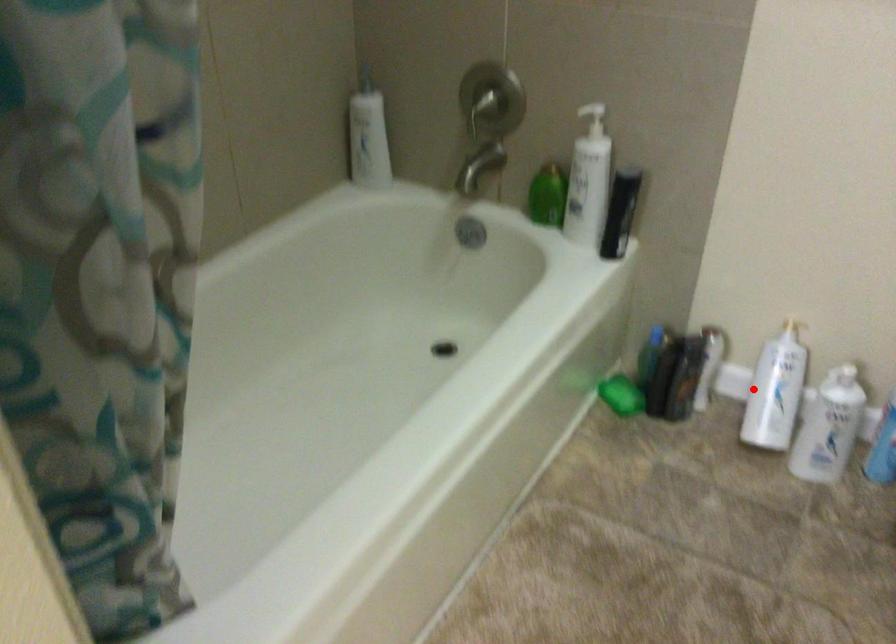
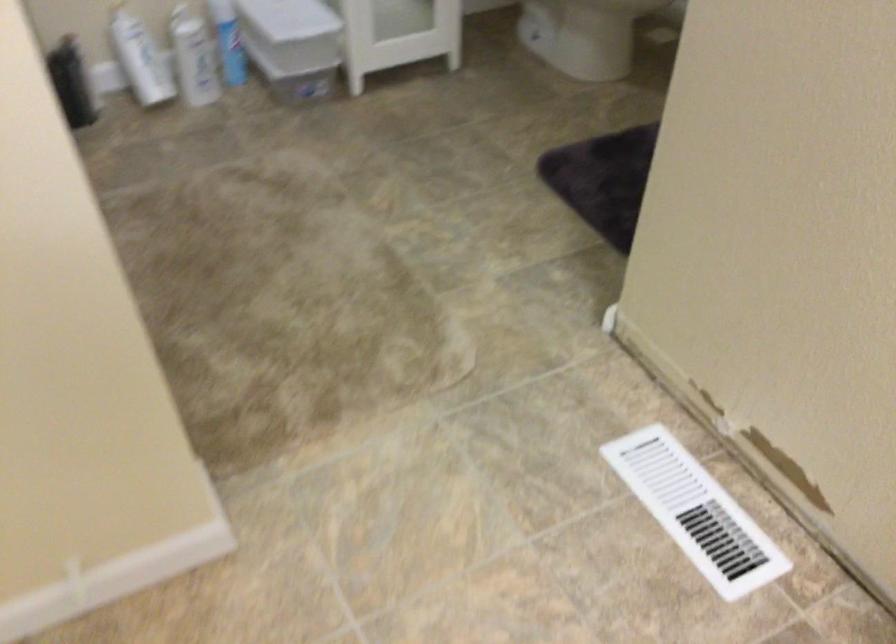
In the second image, find the point that corresponds to the highlighted location in the first image.

(140, 59)